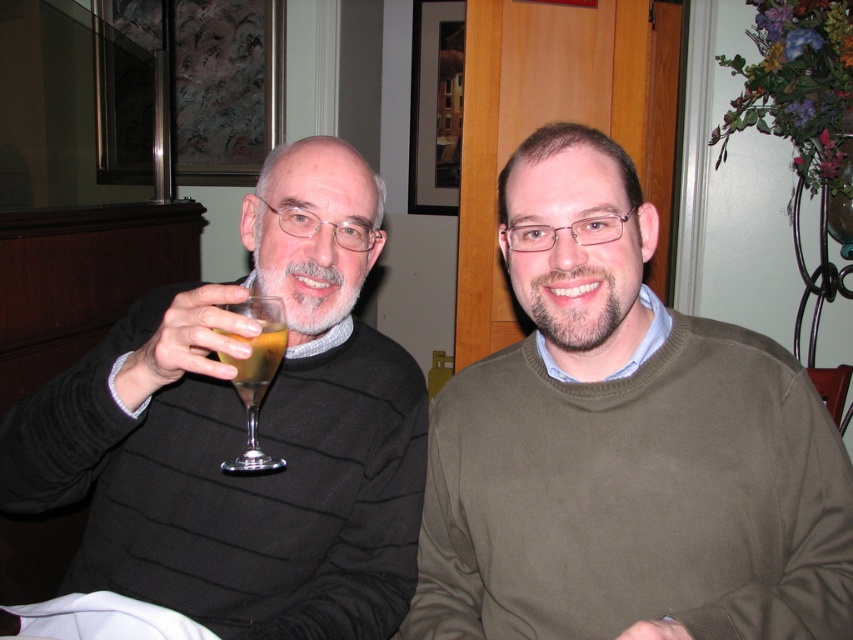
You are organizing a charity event and need to ensure all items fit into a storage box. The storage box can only accommodate items smaller than the black sweater at left. Can the translucent glass at upper left be placed inside the storage box?

The translucent glass at upper left is smaller than the black sweater at left, so yes, it can be placed inside the storage box since it meets the size requirement.